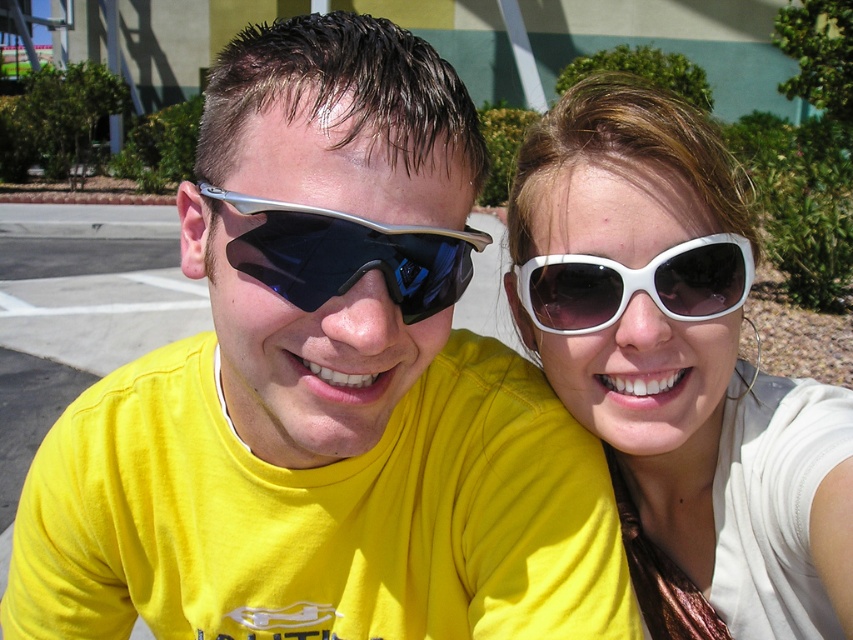
Question: Is white matte sunglasses at upper right positioned behind white plastic sunglasses at upper right?

Choices:
 (A) yes
 (B) no

Answer: (B)

Question: Which point appears farthest from the camera in this image?

Choices:
 (A) (611, 160)
 (B) (392, 280)
 (C) (447, 570)
 (D) (590, 260)

Answer: (A)

Question: Is matte black goggles at center to the right of white plastic sunglasses at upper right from the viewer's perspective?

Choices:
 (A) no
 (B) yes

Answer: (A)

Question: Which of the following is the closest to the observer?

Choices:
 (A) (679, 310)
 (B) (351, 273)
 (C) (595, 417)

Answer: (B)

Question: Where is white matte sunglasses at upper right located in relation to matte black goggles at center in the image?

Choices:
 (A) above
 (B) below

Answer: (B)

Question: Based on their relative distances, which object is nearer to the matte black goggles at center?

Choices:
 (A) white plastic sunglasses at upper right
 (B) white matte sunglasses at upper right
 (C) matte yellow t-shirt at center

Answer: (C)